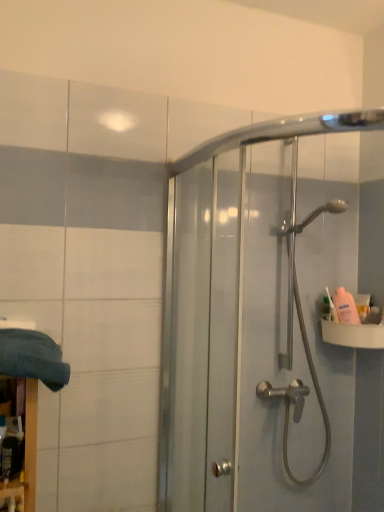
Question: Would you say white plastic sink at right is inside or outside clear glass shower door at upper right?

Choices:
 (A) outside
 (B) inside

Answer: (A)

Question: Is white plastic sink at right bigger or smaller than clear glass shower door at upper right?

Choices:
 (A) big
 (B) small

Answer: (B)

Question: Which of these objects is positioned farthest from the dark blue fabric at lower left?

Choices:
 (A) clear glass shower door at upper right
 (B) white plastic sink at right
 (C) pink plastic bottle at right

Answer: (C)

Question: Based on their relative distances, which object is nearer to the white plastic sink at right?

Choices:
 (A) dark blue fabric at lower left
 (B) clear glass shower door at upper right
 (C) pink plastic bottle at right

Answer: (C)